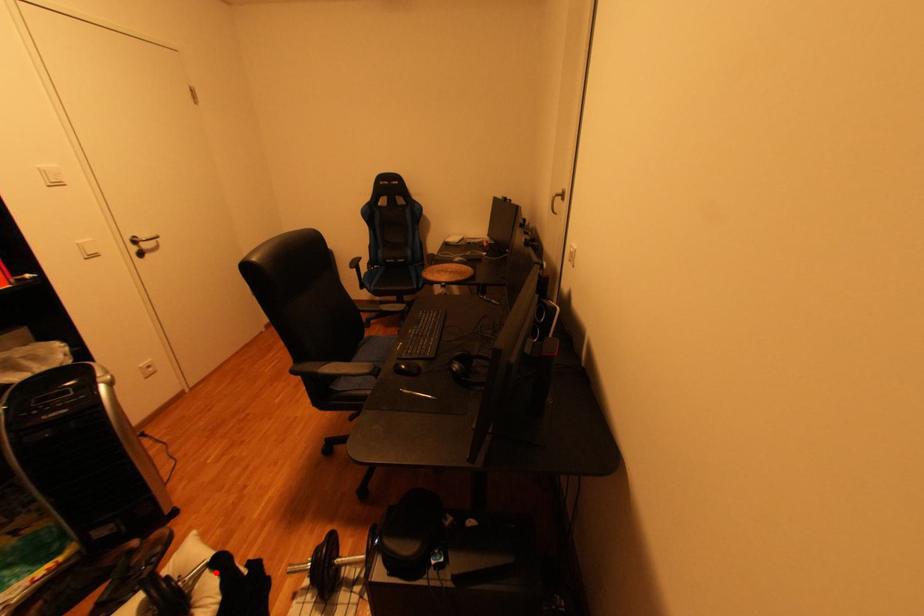
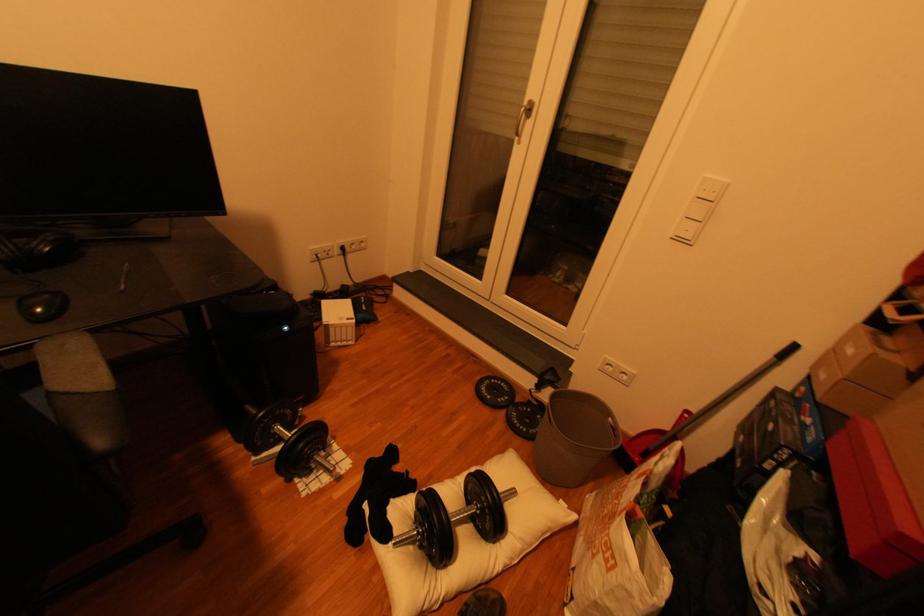
Question: I am providing you with two images of the same scene from different viewpoints. Image1 has a red point marked. In image2, the corresponding 3D location appears at what relative position? Reply with the corresponding letter.

Choices:
 (A) Closer
 (B) Farther

Answer: (A)